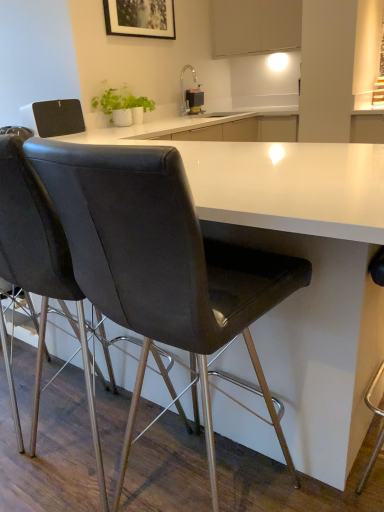
Question: Which direction should I rotate to look at matte black chair at center, the 1th chair positioned from the right, — up or down?

Choices:
 (A) down
 (B) up

Answer: (A)

Question: Could you tell me if matte black chair at center, the first chair positioned from the left, is facing matte black picture frame at upper center?

Choices:
 (A) yes
 (B) no

Answer: (B)

Question: Can you confirm if matte black chair at center, the 2th chair from the right, is bigger than matte black picture frame at upper center?

Choices:
 (A) no
 (B) yes

Answer: (B)

Question: Considering the relative sizes of matte black chair at center, the first chair positioned from the left, and matte black picture frame at upper center in the image provided, is matte black chair at center, the first chair positioned from the left, thinner than matte black picture frame at upper center?

Choices:
 (A) yes
 (B) no

Answer: (B)

Question: From the image's perspective, does matte black chair at center, the first chair positioned from the left, appear higher than matte black picture frame at upper center?

Choices:
 (A) yes
 (B) no

Answer: (B)

Question: Considering the relative sizes of matte black chair at center, the first chair positioned from the left, and matte black picture frame at upper center in the image provided, is matte black chair at center, the first chair positioned from the left, shorter than matte black picture frame at upper center?

Choices:
 (A) no
 (B) yes

Answer: (A)

Question: Does matte black chair at center, the first chair positioned from the left, appear on the right side of matte black picture frame at upper center?

Choices:
 (A) yes
 (B) no

Answer: (B)

Question: Is white matte cabinet at upper center closer to camera compared to matte black chair at center, the 2th chair from the left?

Choices:
 (A) no
 (B) yes

Answer: (A)

Question: From the image's perspective, is white matte cabinet at upper center under matte black chair at center, the 2th chair from the left?

Choices:
 (A) no
 (B) yes

Answer: (A)

Question: From the image's perspective, is white matte cabinet at upper center above matte black chair at center, the 2th chair from the left?

Choices:
 (A) no
 (B) yes

Answer: (B)

Question: Is white matte cabinet at upper center to the right of matte black chair at center, the 1th chair positioned from the right, from the viewer's perspective?

Choices:
 (A) yes
 (B) no

Answer: (A)

Question: Considering the relative sizes of white matte cabinet at upper center and matte black chair at center, the 2th chair from the left, in the image provided, is white matte cabinet at upper center bigger than matte black chair at center, the 2th chair from the left,?

Choices:
 (A) yes
 (B) no

Answer: (B)

Question: Does white matte cabinet at upper center have a greater width compared to matte black chair at center, the 1th chair positioned from the right?

Choices:
 (A) yes
 (B) no

Answer: (B)

Question: Is white matte cabinet at upper center located within metallic black soap dispenser at upper center?

Choices:
 (A) yes
 (B) no

Answer: (B)